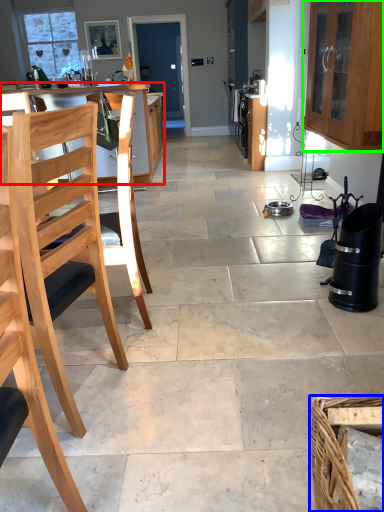
Question: Which object is the farthest from table (highlighted by a red box)? Choose among these: basket (highlighted by a blue box) or cabinetry (highlighted by a green box).

Choices:
 (A) basket
 (B) cabinetry

Answer: (A)